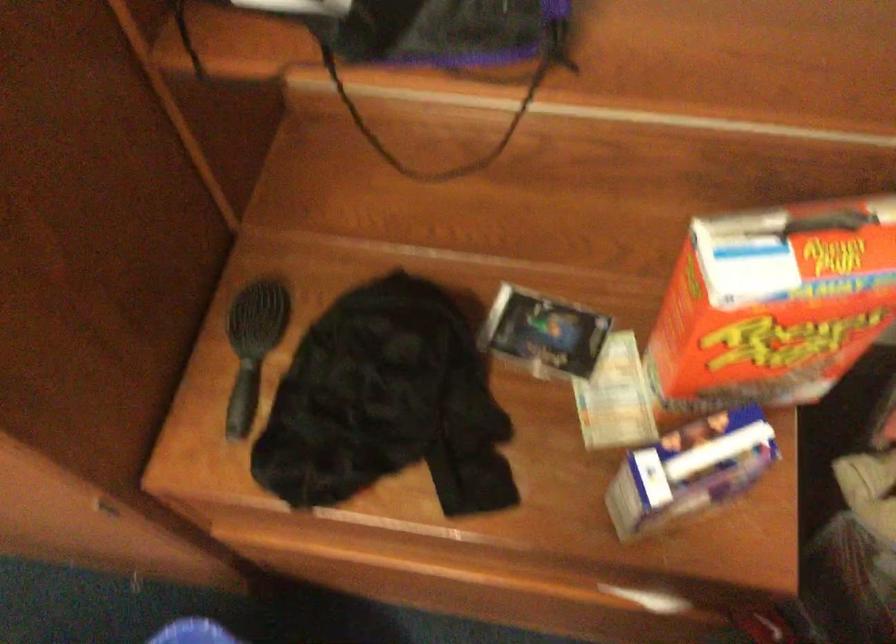
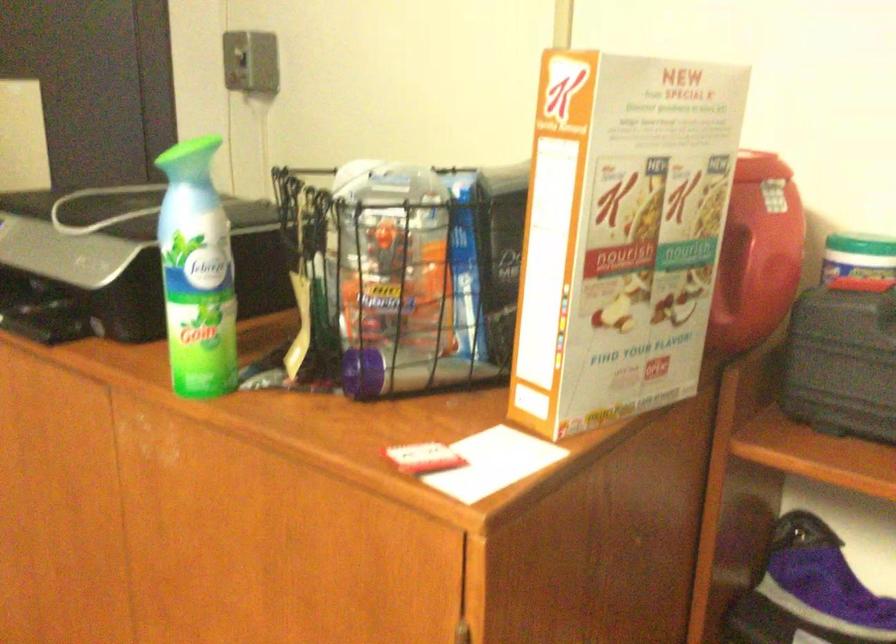
The images are taken continuously from a first-person perspective. In which direction is your viewpoint rotating?

The rotation direction of the camera is left-up.